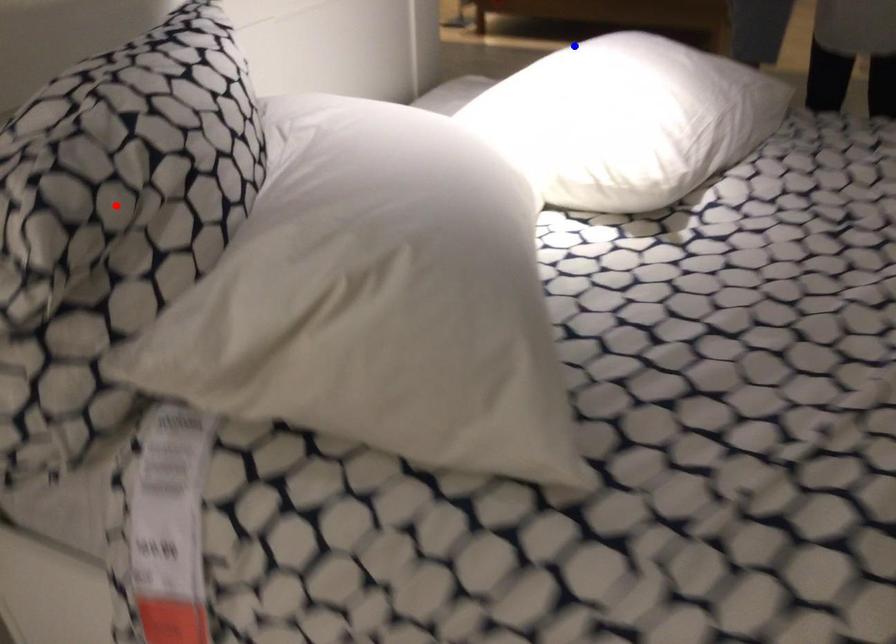
Question: Which of the two points in the image is closer to the camera?

Choices:
 (A) Blue point is closer.
 (B) Red point is closer.

Answer: (B)